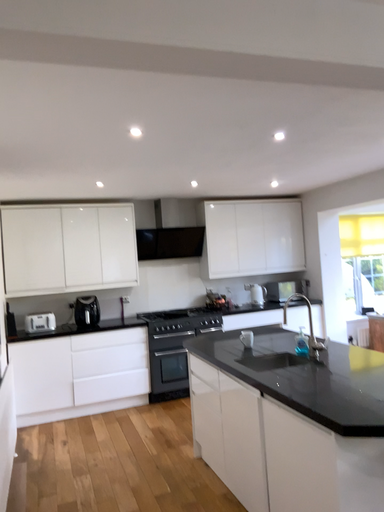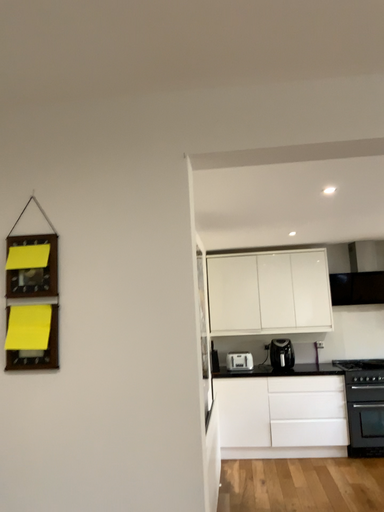
Question: Which way did the camera rotate in the video?

Choices:
 (A) rotated left
 (B) rotated right

Answer: (A)